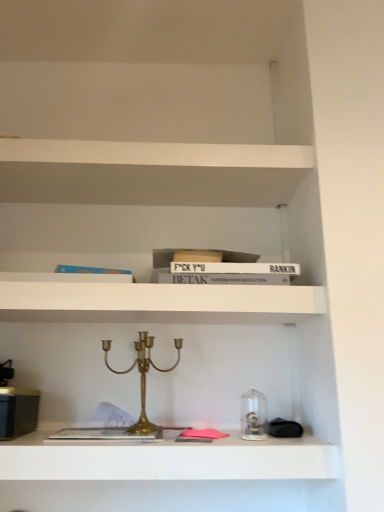
This screenshot has width=384, height=512. Describe the element at coordinates (168, 459) in the screenshot. I see `metallic gold candelabra at center, the 1th shelf ordered from the bottom` at that location.

Identify the location of white matte bookshelf at upper center, which appears as the 2th shelf when ordered from the bottom. The width and height of the screenshot is (384, 512). (158, 303).

Would you consider white matte bookshelf at upper center, which appears as the 2th shelf when ordered from the bottom, to be distant from gold brass candle holder at center?

white matte bookshelf at upper center, which appears as the 2th shelf when ordered from the bottom, is actually quite close to gold brass candle holder at center.

Is white matte bookshelf at upper center, which appears as the 2th shelf when ordered from the bottom, inside the boundaries of gold brass candle holder at center, or outside?

white matte bookshelf at upper center, which appears as the 2th shelf when ordered from the bottom, is spatially situated outside gold brass candle holder at center.

Based on the photo, is white matte bookshelf at upper center, which appears as the 2th shelf when ordered from the bottom, oriented away from gold brass candle holder at center?

No, white matte bookshelf at upper center, which appears as the 2th shelf when ordered from the bottom, is not facing away from gold brass candle holder at center.

Does white matte bookshelf at upper center, which appears as the 2th shelf when ordered from the bottom, have a smaller size compared to gold brass candle holder at center?

No, white matte bookshelf at upper center, which appears as the 2th shelf when ordered from the bottom, is not smaller than gold brass candle holder at center.

Which object is thinner, metallic gold candelabra at center, which is counted as the second shelf, starting from the top, or gold brass candle holder at center?

gold brass candle holder at center.

Is metallic gold candelabra at center, the 1th shelf ordered from the bottom, directly adjacent to gold brass candle holder at center?

metallic gold candelabra at center, the 1th shelf ordered from the bottom, is not next to gold brass candle holder at center, and they're not touching.

Is gold brass candle holder at center inside metallic gold candelabra at center, which is counted as the second shelf, starting from the top?

No, gold brass candle holder at center is located outside of metallic gold candelabra at center, which is counted as the second shelf, starting from the top.

From a real-world perspective, is gold brass candle holder at center over metallic gold candelabra at center, which is counted as the second shelf, starting from the top?

Correct, in the physical world, gold brass candle holder at center is higher than metallic gold candelabra at center, which is counted as the second shelf, starting from the top.

Who is bigger, gold brass candle holder at center or metallic gold candelabra at center, the 1th shelf ordered from the bottom?

Bigger between the two is metallic gold candelabra at center, the 1th shelf ordered from the bottom.

Between gold brass candle holder at center and metallic gold candelabra at center, the 1th shelf ordered from the bottom, which one appears on the left side from the viewer's perspective?

gold brass candle holder at center.

In the scene shown: From a real-world perspective, does white matte bookshelf at upper center, which appears as the 2th shelf when ordered from the bottom, stand above metallic gold candelabra at center, which is counted as the second shelf, starting from the top?

Indeed, from a real-world perspective, white matte bookshelf at upper center, which appears as the 2th shelf when ordered from the bottom, stands above metallic gold candelabra at center, which is counted as the second shelf, starting from the top.

Who is taller, white matte bookshelf at upper center, arranged as the 1th shelf when viewed from the top, or metallic gold candelabra at center, the 1th shelf ordered from the bottom?

metallic gold candelabra at center, the 1th shelf ordered from the bottom.

Which of these two, white matte bookshelf at upper center, arranged as the 1th shelf when viewed from the top, or metallic gold candelabra at center, which is counted as the second shelf, starting from the top, is bigger?

Bigger between the two is white matte bookshelf at upper center, arranged as the 1th shelf when viewed from the top.

From a real-world perspective, does gold brass candle holder at center sit lower than white matte bookshelf at upper center, arranged as the 1th shelf when viewed from the top?

Yes.

Considering the relative sizes of gold brass candle holder at center and white matte bookshelf at upper center, which appears as the 2th shelf when ordered from the bottom, in the image provided, is gold brass candle holder at center bigger than white matte bookshelf at upper center, which appears as the 2th shelf when ordered from the bottom,?

No.

Visually, is gold brass candle holder at center positioned to the left or to the right of white matte bookshelf at upper center, which appears as the 2th shelf when ordered from the bottom?

Based on their positions, gold brass candle holder at center is located to the right of white matte bookshelf at upper center, which appears as the 2th shelf when ordered from the bottom.

Is the position of gold brass candle holder at center more distant than that of white matte bookshelf at upper center, which appears as the 2th shelf when ordered from the bottom?

No, gold brass candle holder at center is closer to the viewer.

From the picture: Considering the sizes of objects metallic gold candelabra at center, which is counted as the second shelf, starting from the top, and white matte bookshelf at upper center, arranged as the 1th shelf when viewed from the top, in the image provided, who is thinner, metallic gold candelabra at center, which is counted as the second shelf, starting from the top, or white matte bookshelf at upper center, arranged as the 1th shelf when viewed from the top,?

white matte bookshelf at upper center, arranged as the 1th shelf when viewed from the top, is thinner.

Does metallic gold candelabra at center, which is counted as the second shelf, starting from the top, appear on the right side of white matte bookshelf at upper center, which appears as the 2th shelf when ordered from the bottom?

Correct, you'll find metallic gold candelabra at center, which is counted as the second shelf, starting from the top, to the right of white matte bookshelf at upper center, which appears as the 2th shelf when ordered from the bottom.

Considering the points (280, 466) and (269, 315), which point is behind, point (280, 466) or point (269, 315)?

The point (269, 315) is farther.

From a real-world perspective, which object rests below the other?

In real-world perspective, metallic gold candelabra at center, the 1th shelf ordered from the bottom, is lower.

At what (x,y) coordinates should I click in order to perform the action: click on candle holder below the white matte bookshelf at upper center, which appears as the 2th shelf when ordered from the bottom (from the image's perspective). Please return your answer as a coordinate pair (x, y). The height and width of the screenshot is (512, 384). Looking at the image, I should click on (142, 376).

Locate an element on the screen. This screenshot has width=384, height=512. candle holder above the metallic gold candelabra at center, the 1th shelf ordered from the bottom (from a real-world perspective) is located at coordinates (142, 376).

Looking at the image, which one is located closer to metallic gold candelabra at center, which is counted as the second shelf, starting from the top, gold brass candle holder at center or white matte bookshelf at upper center, arranged as the 1th shelf when viewed from the top?

gold brass candle holder at center is closer to metallic gold candelabra at center, which is counted as the second shelf, starting from the top.

From the image, which object appears to be farther from gold brass candle holder at center, white matte bookshelf at upper center, arranged as the 1th shelf when viewed from the top, or metallic gold candelabra at center, which is counted as the second shelf, starting from the top?

The object further to gold brass candle holder at center is metallic gold candelabra at center, which is counted as the second shelf, starting from the top.

Looking at the image, which one is located further to white matte bookshelf at upper center, which appears as the 2th shelf when ordered from the bottom, gold brass candle holder at center or metallic gold candelabra at center, the 1th shelf ordered from the bottom?

metallic gold candelabra at center, the 1th shelf ordered from the bottom, is further to white matte bookshelf at upper center, which appears as the 2th shelf when ordered from the bottom.

Considering their positions, is white matte bookshelf at upper center, arranged as the 1th shelf when viewed from the top, positioned closer to metallic gold candelabra at center, the 1th shelf ordered from the bottom, than gold brass candle holder at center?

gold brass candle holder at center is closer to metallic gold candelabra at center, the 1th shelf ordered from the bottom.

From the image, which object appears to be nearer to white matte bookshelf at upper center, which appears as the 2th shelf when ordered from the bottom, metallic gold candelabra at center, which is counted as the second shelf, starting from the top, or gold brass candle holder at center?

gold brass candle holder at center is closer to white matte bookshelf at upper center, which appears as the 2th shelf when ordered from the bottom.

Looking at the image, which one is located further to gold brass candle holder at center, metallic gold candelabra at center, which is counted as the second shelf, starting from the top, or white matte bookshelf at upper center, which appears as the 2th shelf when ordered from the bottom?

The object further to gold brass candle holder at center is metallic gold candelabra at center, which is counted as the second shelf, starting from the top.

Locate an element on the screen. candle holder between white matte bookshelf at upper center, which appears as the 2th shelf when ordered from the bottom, and metallic gold candelabra at center, the 1th shelf ordered from the bottom, in the vertical direction is located at coordinates (142, 376).